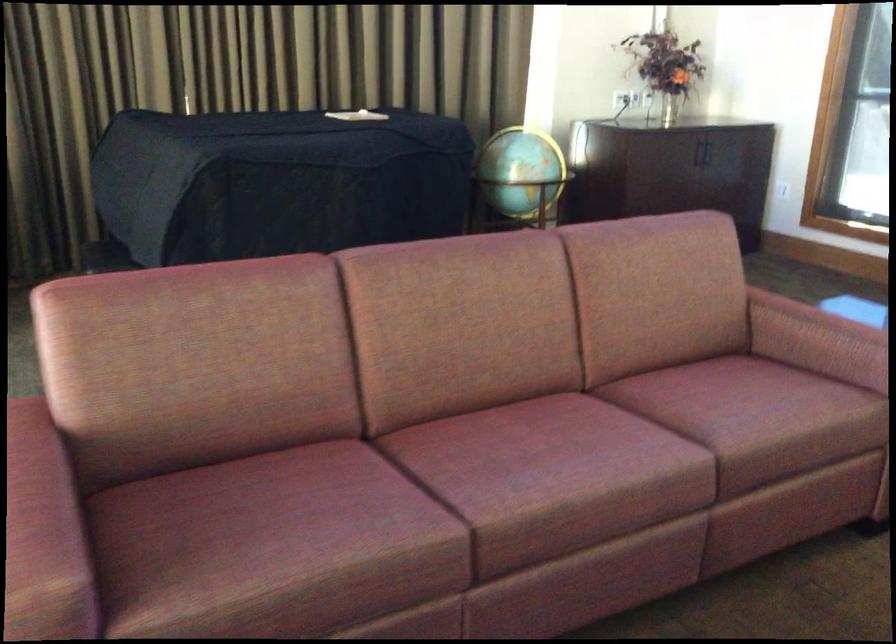
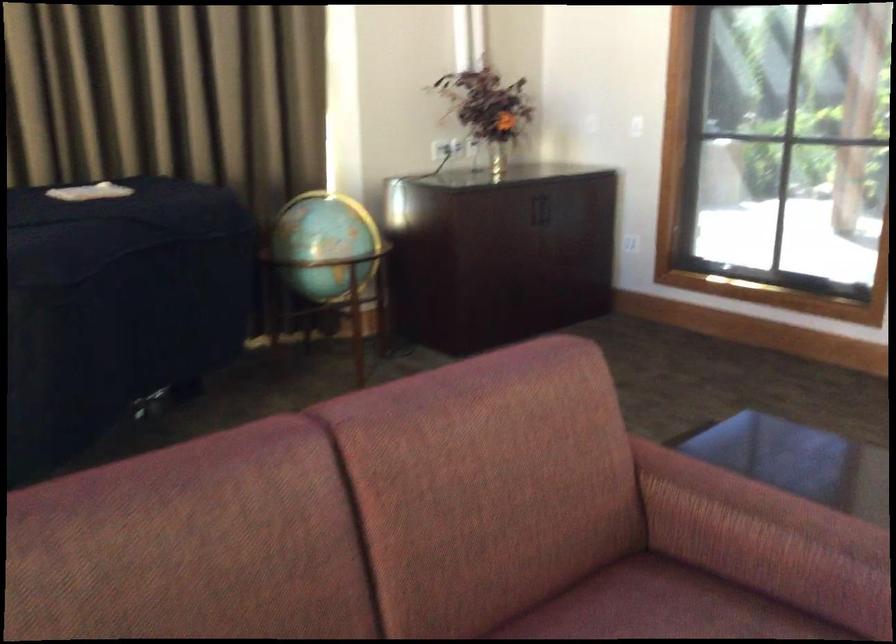
Question: The first image is from the beginning of the video and the second image is from the end. How did the camera likely rotate when shooting the video?

Choices:
 (A) Left
 (B) Right
 (C) Up
 (D) Down

Answer: (B)